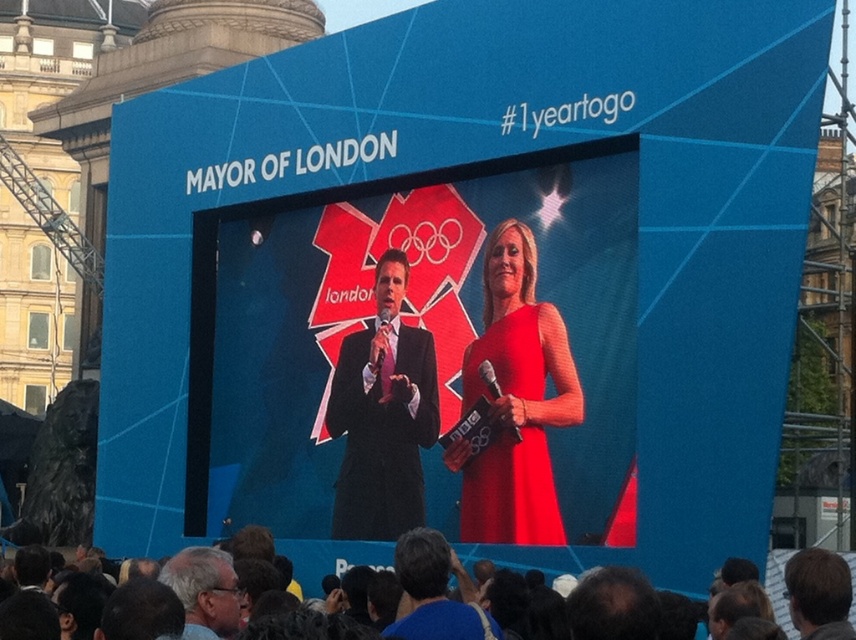
Question: Does dark blue fabric at lower center appear under gray hair at lower center?

Choices:
 (A) no
 (B) yes

Answer: (B)

Question: Which point is farther from the camera taking this photo?

Choices:
 (A) (574, 550)
 (B) (810, 554)
 (C) (566, 353)
 (D) (574, 536)

Answer: (C)

Question: Is matte red dress at center further to camera compared to gray hair at lower center?

Choices:
 (A) no
 (B) yes

Answer: (B)

Question: Which point is farther to the camera?

Choices:
 (A) dark blue suit at center
 (B) smooth brown hair at center
 (C) smooth glossy screen at center
 (D) matte red dress at center

Answer: (D)

Question: Considering the real-world distances, which object is closest to the smooth glossy screen at center?

Choices:
 (A) matte black suit at center
 (B) matte red dress at center
 (C) dark blue suit at center
 (D) smooth brown hair at center

Answer: (B)

Question: Can you confirm if dark blue suit at center is bigger than smooth brown hair at center?

Choices:
 (A) no
 (B) yes

Answer: (A)